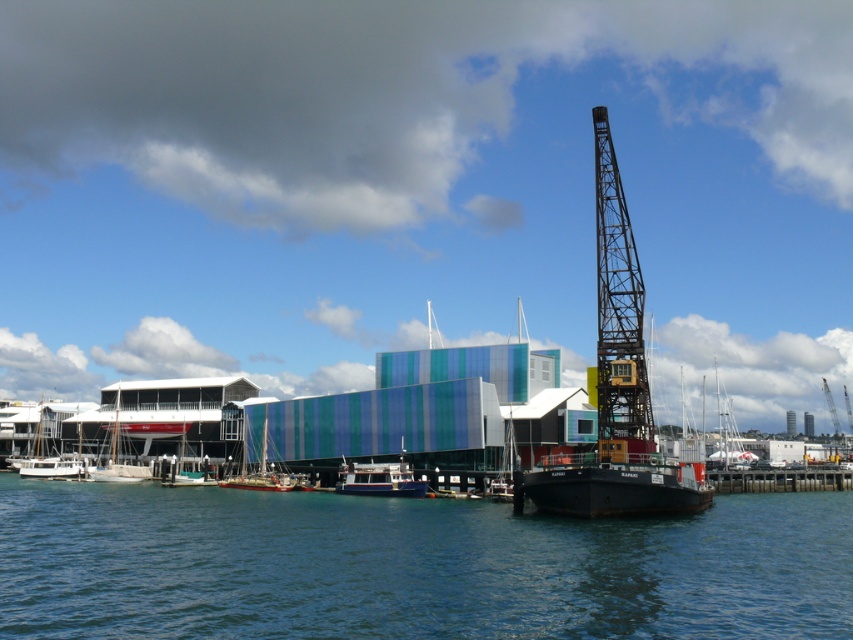
Question: Can you confirm if white glossy boat at center is positioned to the right of wooden sailboat at center?

Choices:
 (A) no
 (B) yes

Answer: (B)

Question: Which object is farther from the camera taking this photo?

Choices:
 (A) white matte sailboat at right
 (B) wooden sailboat at center
 (C) black metal crane at center
 (D) white glossy boat at center

Answer: (A)

Question: Which object appears closest to the camera in this image?

Choices:
 (A) white wooden sailboat at left
 (B) wooden sailboat at center
 (C) black matte boat at center

Answer: (C)

Question: In this image, where is black matte boat at center located relative to white glossy boat at lower left?

Choices:
 (A) left
 (B) right

Answer: (B)

Question: Is the position of white glossy boat at center less distant than that of white wooden sailboat at left?

Choices:
 (A) yes
 (B) no

Answer: (A)

Question: Among these points, which one is farthest from the camera?

Choices:
 (A) (598, 499)
 (B) (718, 396)
 (C) (212, 480)

Answer: (B)